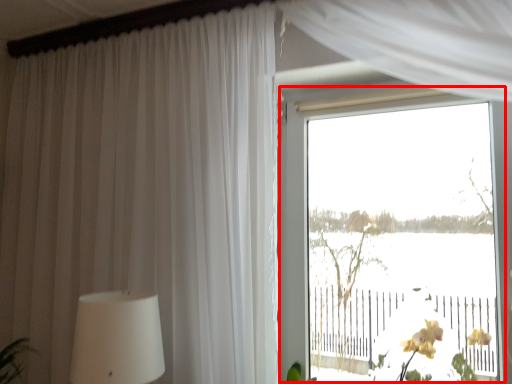
Question: From the image, what is the correct spatial relationship of window (annotated by the red box) in relation to rail?

Choices:
 (A) right
 (B) left

Answer: (B)